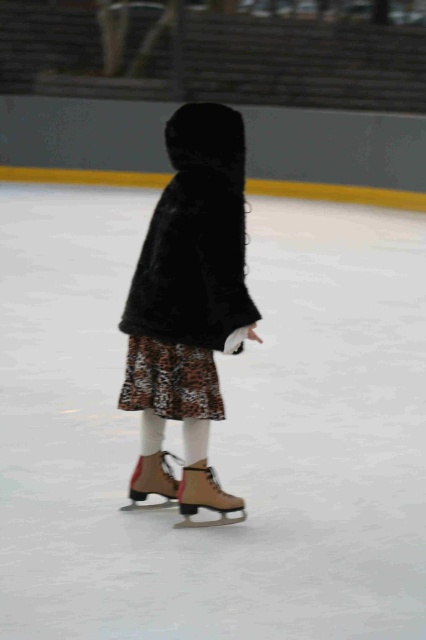
Between brown leather roller skate at center and brown suede roller skate at center, which one has less height?

brown suede roller skate at center is shorter.

Consider the image. Does brown leather roller skate at center have a greater width compared to brown suede roller skate at center?

Correct, the width of brown leather roller skate at center exceeds that of brown suede roller skate at center.

Between point (198, 467) and point (166, 477), which one is positioned in front?

Point (198, 467)

Identify the location of brown leather roller skate at center. (204, 497).

Between white ice at center and brown suede roller skate at center, which one is positioned lower?

Positioned lower is brown suede roller skate at center.

Is the position of white ice at center more distant than that of brown suede roller skate at center?

No, it is in front of brown suede roller skate at center.

Which is in front, point (152, 637) or point (158, 493)?

Point (152, 637)

This screenshot has width=426, height=640. I want to click on white ice at center, so click(x=215, y=432).

Looking at this image, does white ice at center appear over brown leather roller skate at center?

Correct, white ice at center is located above brown leather roller skate at center.

From the picture: Which of these two, white ice at center or brown leather roller skate at center, stands shorter?

brown leather roller skate at center

Where is `white ice at center`? The image size is (426, 640). white ice at center is located at coordinates (215, 432).